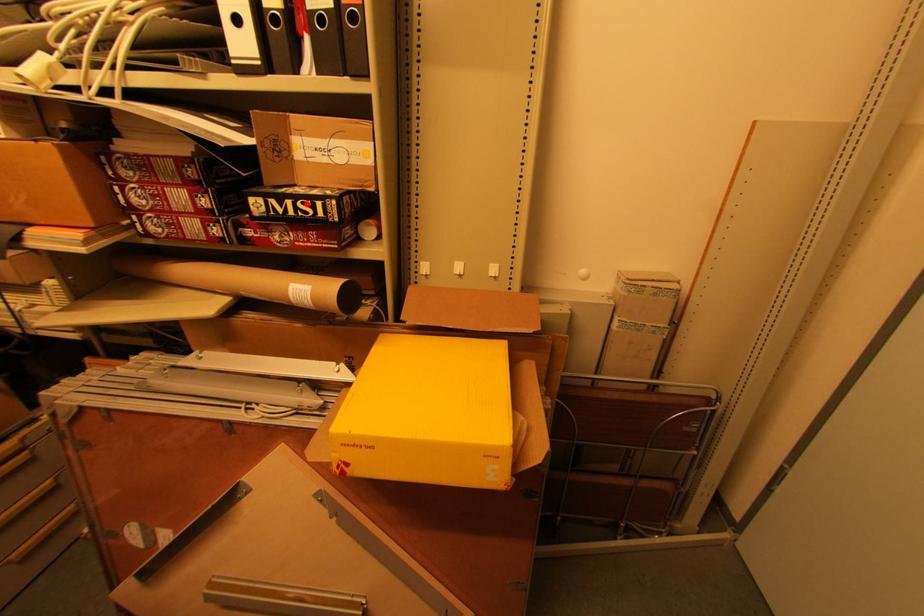
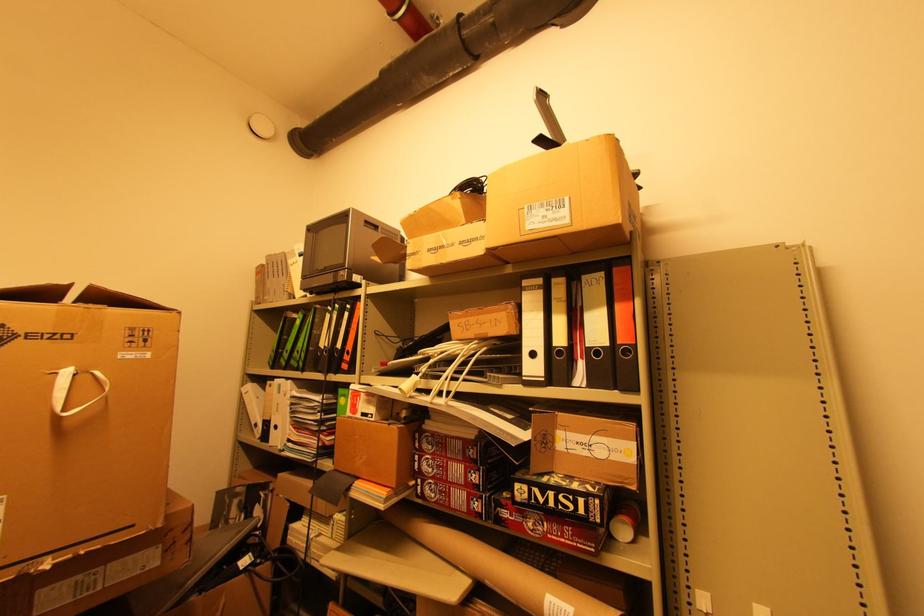
Question: I am providing you with two images of the same scene from different viewpoints. A red point is marked on the first image. At the location where the point appears in image 1, is it still visible in image 2?

Choices:
 (A) Yes
 (B) No

Answer: (A)